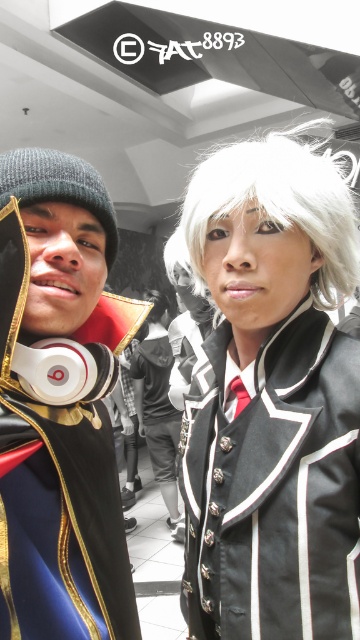
What do you see at coordinates (273, 486) in the screenshot? This screenshot has width=360, height=640. I see `black leather jacket at upper right` at bounding box center [273, 486].

Is black leather jacket at upper right positioned at the back of white silky wig at upper right?

No, it is in front of white silky wig at upper right.

The height and width of the screenshot is (640, 360). What do you see at coordinates (273, 486) in the screenshot? I see `black leather jacket at upper right` at bounding box center [273, 486].

Find the location of a particular element. The width and height of the screenshot is (360, 640). black leather jacket at upper right is located at coordinates 273,486.

Is satin black wig at upper right below white matte wig at upper center?

Yes, satin black wig at upper right is below white matte wig at upper center.

Between point (156, 428) and point (151, 312), which one is positioned behind?

The point (151, 312) is more distant.

In the scene shown: Who is more distant from viewer, (159,310) or (160,316)?

The point (159,310) is behind.

You are a GUI agent. You are given a task and a screenshot of the screen. Output one action in this format:
    pyautogui.click(x=<x>, y=<y>)
    Task: Click on the satin black wig at upper right
    The height and width of the screenshot is (640, 360).
    Given the screenshot: What is the action you would take?
    pyautogui.click(x=158, y=404)

Which is behind, point (88, 268) or point (146, 385)?

The point (146, 385) is behind.

Find the location of a particular element. Image resolution: width=360 pixels, height=640 pixels. matte black hoodie at left is located at coordinates (60, 404).